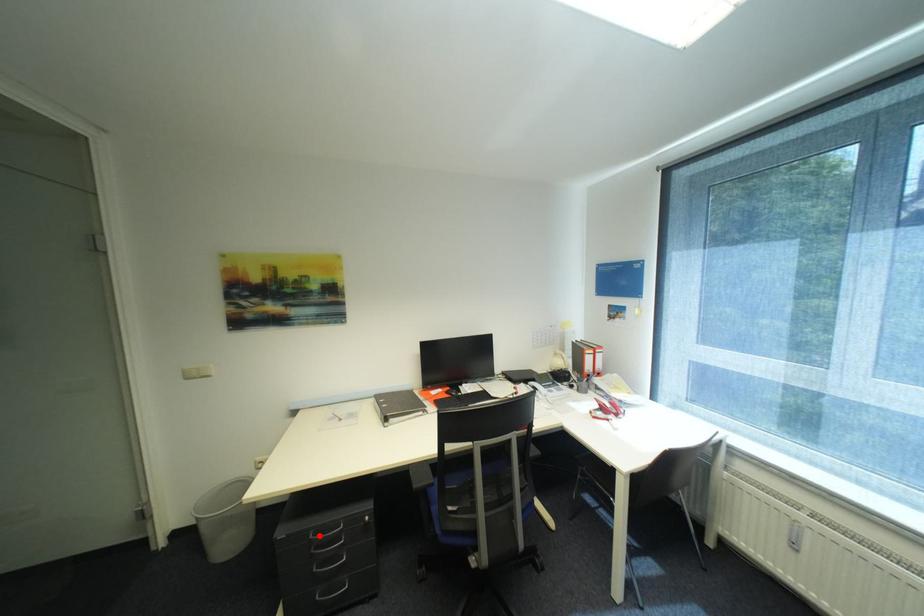
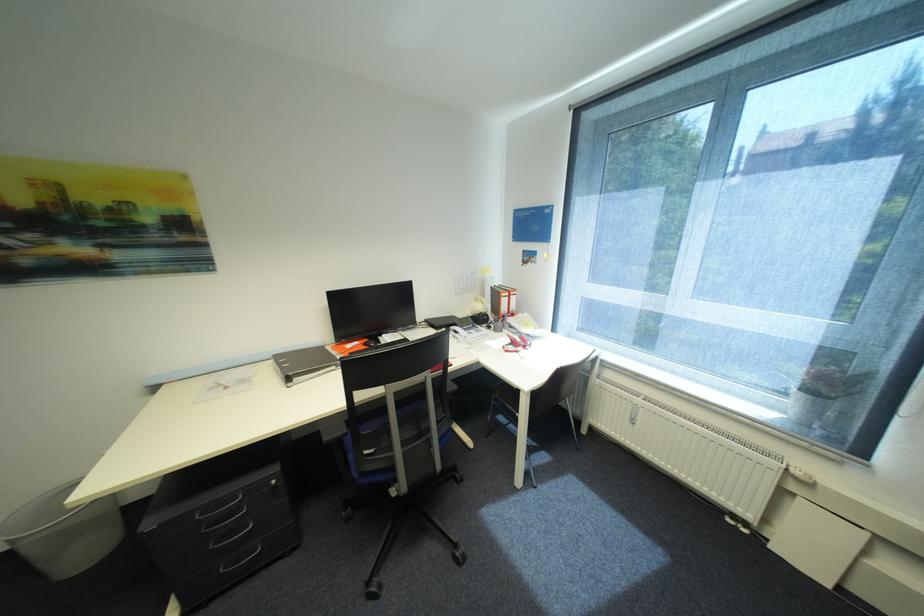
Find the pixel in the second image that matches the highlighted location in the first image.

(205, 516)